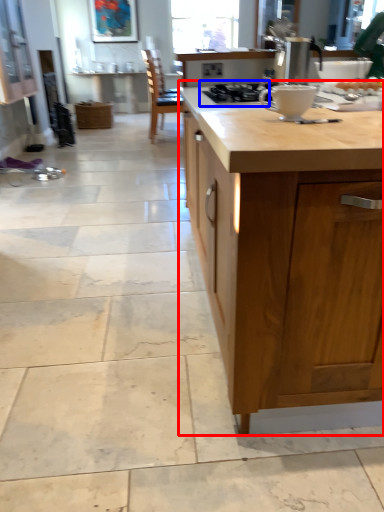
Question: Which of the following is the closest to the observer, countertop (highlighted by a red box) or gas stove (highlighted by a blue box)?

Choices:
 (A) countertop
 (B) gas stove

Answer: (A)